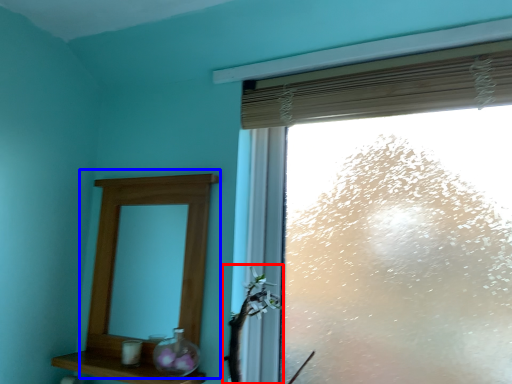
Question: Which of the following is the closest to the observer, plant (highlighted by a red box) or medicine cabinet (highlighted by a blue box)?

Choices:
 (A) plant
 (B) medicine cabinet

Answer: (A)